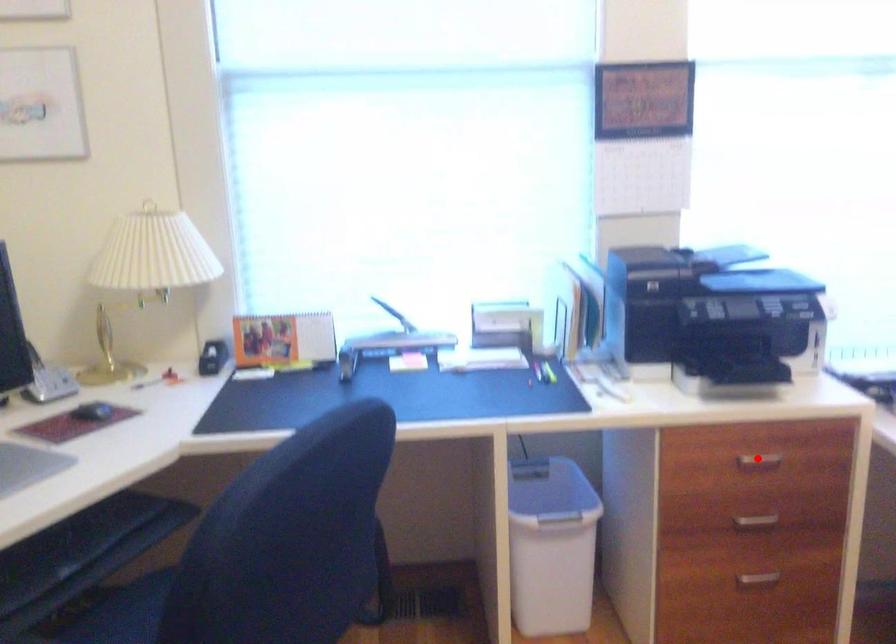
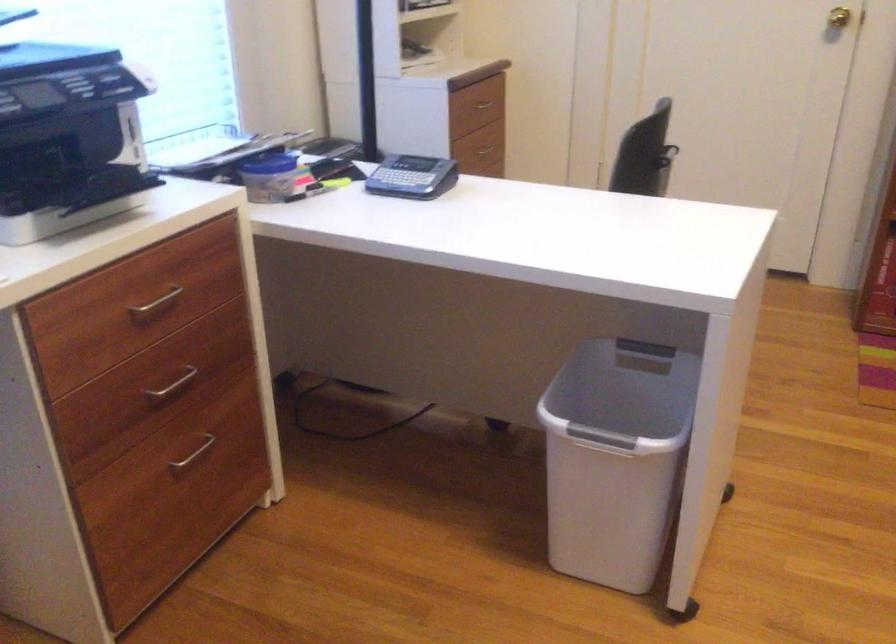
Question: I am providing you with two images of the same scene from different viewpoints. In image1, a red point is highlighted. Considering the same 3D point in image2, which of the following is correct?

Choices:
 (A) It is closer
 (B) It is farther

Answer: (A)